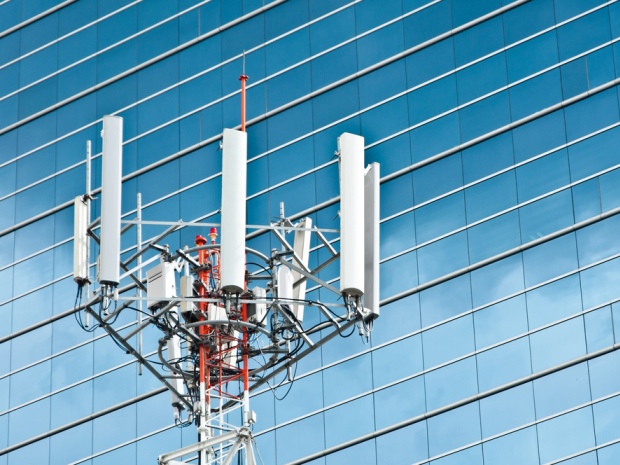
Locate an element on the screen. white rectangular panels is located at coordinates (157, 284), (255, 307).